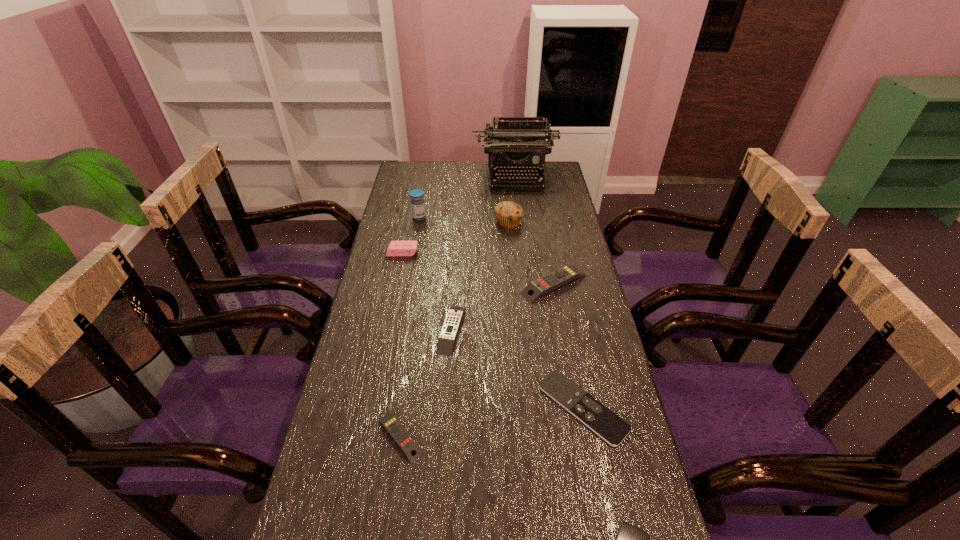
This screenshot has width=960, height=540. In the image, there is a desktop. What are the coordinates of `vacant space at the left edge` in the screenshot? It's located at (379, 325).

What are the coordinates of `vacant space at the right edge` in the screenshot? It's located at (621, 399).

Where is `blank space at the far left corner of the desktop`? blank space at the far left corner of the desktop is located at coordinates [x=407, y=179].

Image resolution: width=960 pixels, height=540 pixels. In order to click on free space at the far right corner of the desktop in this screenshot , I will do `click(549, 175)`.

The height and width of the screenshot is (540, 960). I want to click on free area in between the fifth farthest object and the blue medicine, so click(x=487, y=251).

The width and height of the screenshot is (960, 540). What are the coordinates of `vacant point located between the farthest object and the fourth object from left to right` in the screenshot? It's located at 484,253.

This screenshot has width=960, height=540. In order to click on vacant space that's between the eraser and the second tallest object in this screenshot , I will do `click(411, 235)`.

Where is `free space that is in between the second shortest object and the rightmost yellow remote control`? The width and height of the screenshot is (960, 540). free space that is in between the second shortest object and the rightmost yellow remote control is located at coordinates (568, 346).

You are a GUI agent. You are given a task and a screenshot of the screen. Output one action in this format:
    pyautogui.click(x=<x>, y=<y>)
    Task: Click on the object that is the eighth closest one to the sixth object from right to left
    This screenshot has width=960, height=540.
    Given the screenshot: What is the action you would take?
    pyautogui.click(x=515, y=144)

Select which object appears as the third closest to the fourth shortest remote control. Please provide its 2D coordinates. Your answer should be formatted as a tuple, i.e. [(x, y)], where the tuple contains the x and y coordinates of a point satisfying the conditions above.

[(610, 427)]